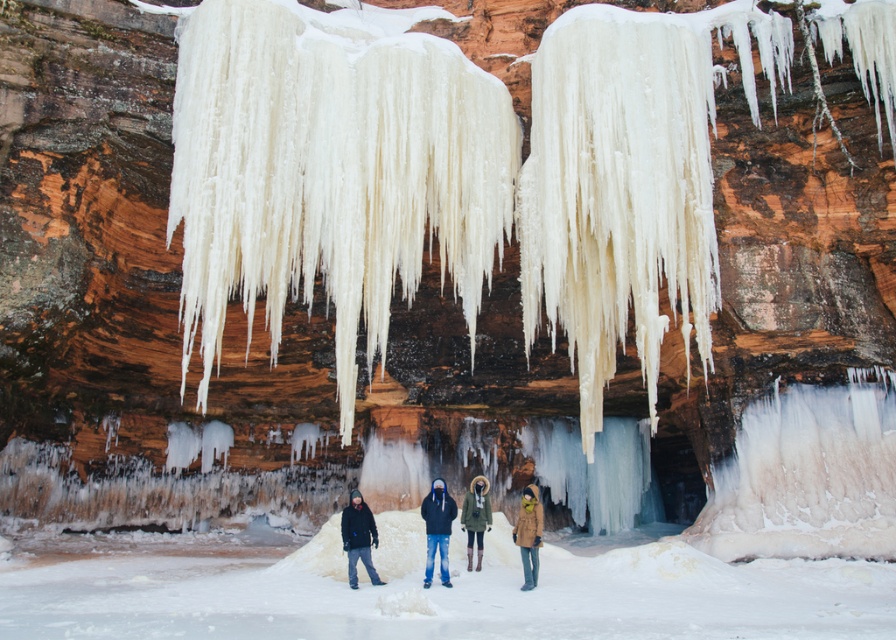
Question: Among these points, which one is farthest from the camera?

Choices:
 (A) (350, 545)
 (B) (537, 516)

Answer: (B)

Question: Is the position of black matte jacket at lower left more distant than that of tan leather coat at center?

Choices:
 (A) no
 (B) yes

Answer: (B)

Question: Which point is farther from the camera taking this photo?

Choices:
 (A) (438, 552)
 (B) (425, 560)

Answer: (B)

Question: Which is nearer to the tan leather coat at center?

Choices:
 (A) olive-green wool coat at center
 (B) black matte jacket at center

Answer: (A)

Question: Is black matte jacket at center in front of olive-green wool coat at center?

Choices:
 (A) yes
 (B) no

Answer: (A)

Question: Can you confirm if black matte jacket at center is wider than black matte jacket at lower left?

Choices:
 (A) yes
 (B) no

Answer: (B)